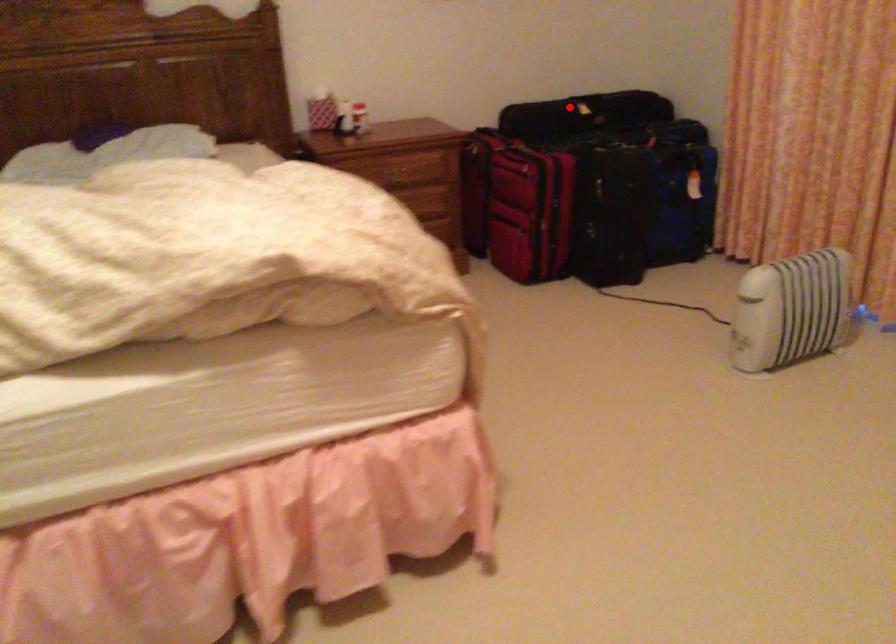
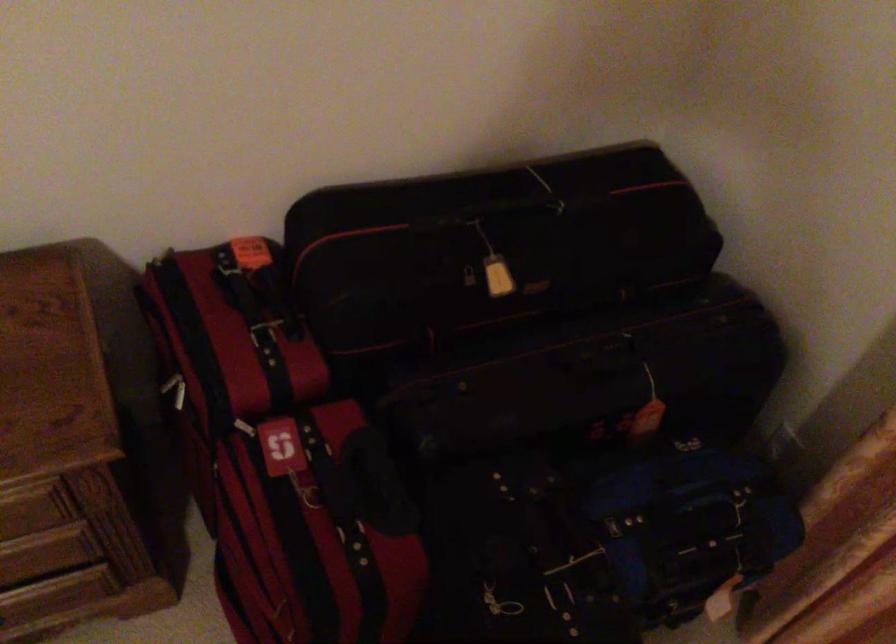
Question: I am providing you with two images of the same scene from different viewpoints. A red point is shown in image1. For the corresponding object point in image2, is it positioned nearer or farther from the camera?

Choices:
 (A) Nearer
 (B) Farther

Answer: (A)